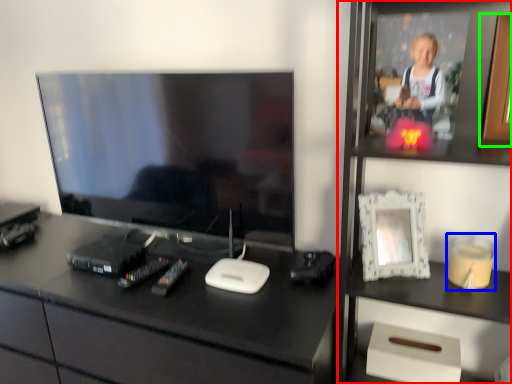
Question: Which object is the closest to the bookshelf (highlighted by a red box)? Choose among these: candle holder (highlighted by a blue box) or picture frame (highlighted by a green box).

Choices:
 (A) candle holder
 (B) picture frame

Answer: (A)